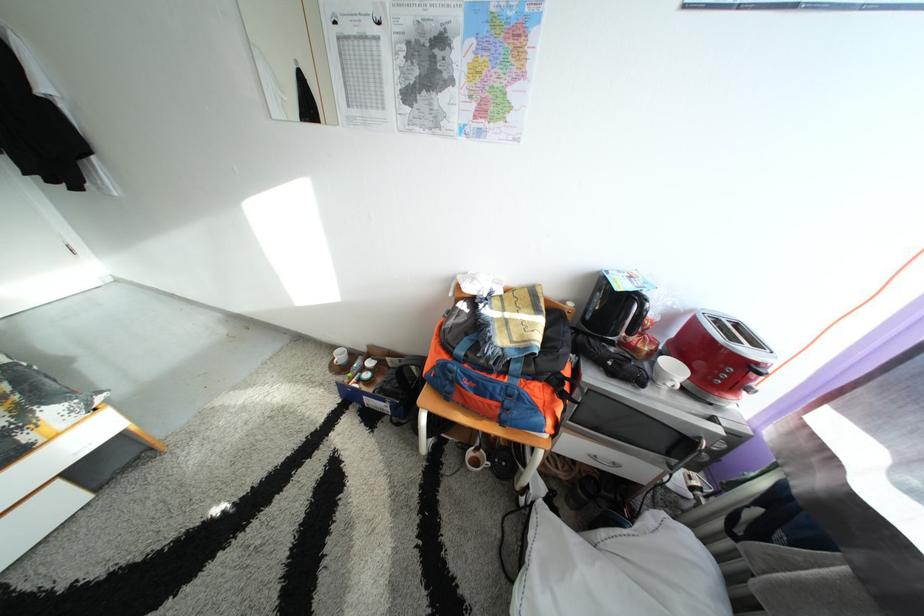
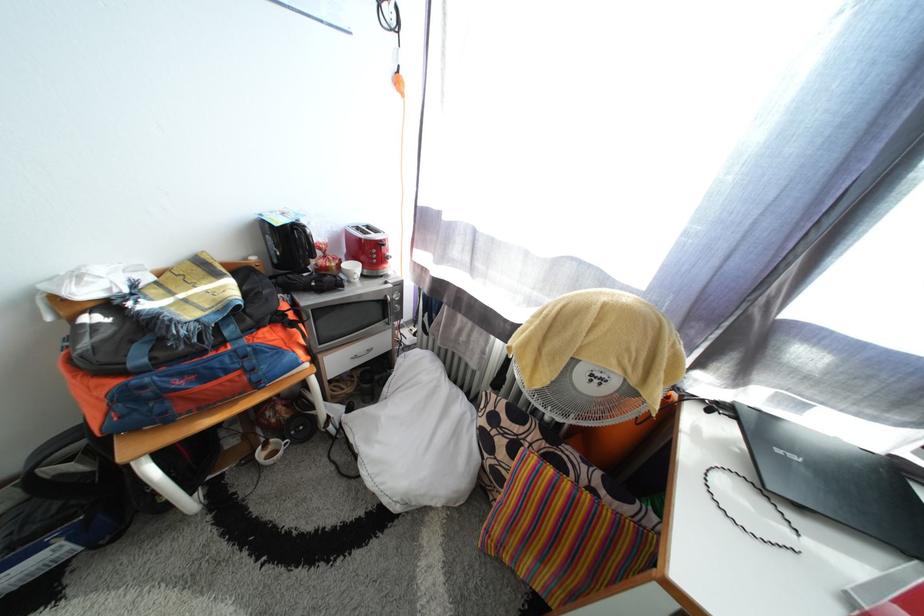
Find the pixel in the second image that matches (x=487, y=461) in the first image.

(280, 455)